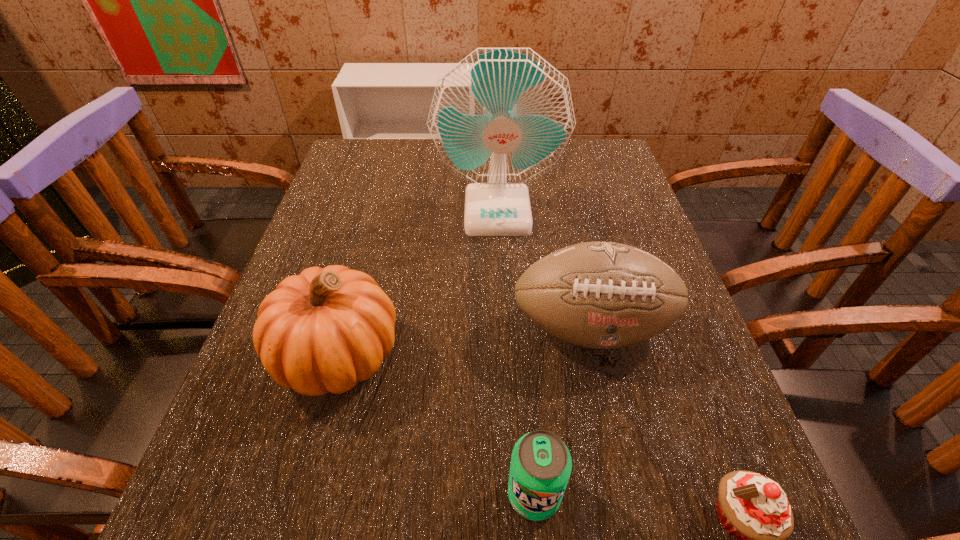
Locate an element on the screen. This screenshot has height=540, width=960. object that is positioned at the right edge is located at coordinates (604, 295).

I want to click on vacant space at the near edge of the desktop, so click(x=501, y=494).

In the image, there is a desktop. In order to click on vacant space at the left edge in this screenshot , I will do `click(352, 207)`.

In the image, there is a desktop. Identify the location of free space at the right edge. (643, 374).

Locate an element on the screen. vacant space at the far left corner of the desktop is located at coordinates (345, 178).

Locate an element on the screen. This screenshot has width=960, height=540. vacant space at the near left corner is located at coordinates (192, 536).

Locate an element on the screen. The height and width of the screenshot is (540, 960). vacant space at the far right corner of the desktop is located at coordinates (592, 145).

The width and height of the screenshot is (960, 540). Find the location of `vacant space in between the farthest object and the pop soda`. vacant space in between the farthest object and the pop soda is located at coordinates (516, 353).

Where is `free space that is in between the tallest object and the pop soda`? free space that is in between the tallest object and the pop soda is located at coordinates (516, 353).

The width and height of the screenshot is (960, 540). I want to click on vacant area between the pumpkin and the fan, so click(418, 283).